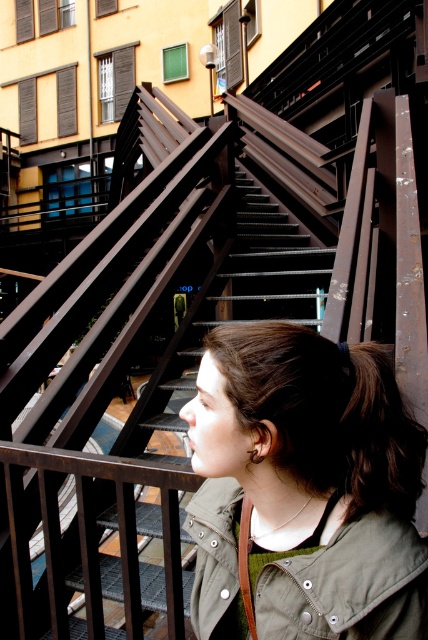
You are a photographer trying to capture a closeup of the person in the scene. You want to ensure that both the matte olive green jacket at lower right and the brown matte hair at lower right are in focus. Given that your camera can only focus on objects within a 4 inch range, will you be able to achieve this?

The matte olive green jacket at lower right and brown matte hair at lower right are 4.37 inches apart from each other. Since the camera can only focus on objects within a 4 inch range, the distance between them exceeds the camera s focusing capability. Therefore, you will not be able to have both in focus simultaneously.

You are standing at the edge of the metal staircase looking down. You notice a point marked at coordinates (303, 490). What object is located at that point?

The point at coordinates (303, 490) indicates the matte olive green jacket at lower right.

Looking at this image, you are a photographer trying to capture the person in the image. You notice the matte olive green jacket at lower right and the brown matte hair at lower right. Which object should you focus on first to ensure it is in sharp focus if you want both to be clear?

The matte olive green jacket at lower right is closer to the viewer than the brown matte hair at lower right. To ensure both are in focus, you should focus on the matte olive green jacket at lower right first since it is closer.